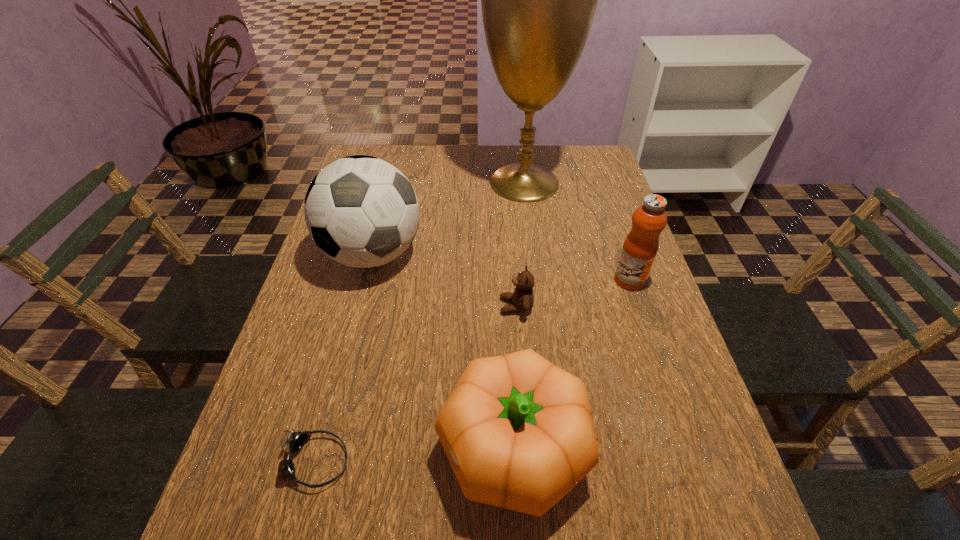
Locate an element on the screen. vacant area that satisfies the following two spatial constraints: 1. on the front label of the fruit juice; 2. at the face of the second shortest object is located at coordinates (638, 306).

The width and height of the screenshot is (960, 540). I want to click on blank area in the image that satisfies the following two spatial constraints: 1. on the front label of the fruit juice; 2. on the carved face of the fourth tallest object, so click(x=686, y=449).

You are a GUI agent. You are given a task and a screenshot of the screen. Output one action in this format:
    pyautogui.click(x=<x>, y=<y>)
    Task: Click on the free spot that satisfies the following two spatial constraints: 1. on the front label of the rightmost object; 2. on the carved face of the pumpkin
    This screenshot has width=960, height=540.
    Given the screenshot: What is the action you would take?
    pyautogui.click(x=686, y=449)